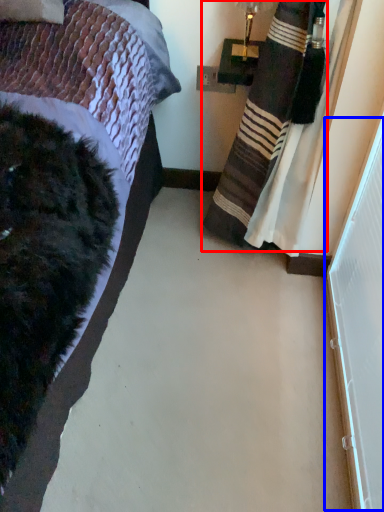
Question: Which object is closer to the camera taking this photo, curtain (highlighted by a red box) or screen door (highlighted by a blue box)?

Choices:
 (A) curtain
 (B) screen door

Answer: (B)